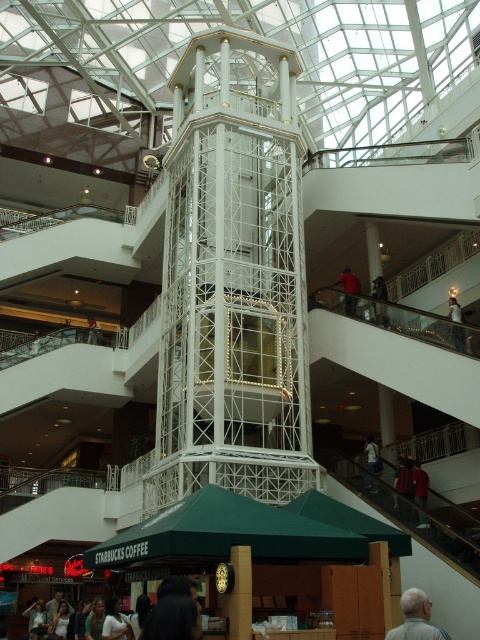
From the picture: Is white metallic pillar at center further to camera compared to dark blue jeans at center?

No, white metallic pillar at center is closer to the viewer.

Based on the photo, who is higher up, white metallic pillar at center or dark blue jeans at center?

dark blue jeans at center

At what (x,y) coordinates should I click in order to perform the action: click on white metallic pillar at center. Please return your answer as a coordinate pair (x, y). Looking at the image, I should click on (240, 593).

Between point (421, 508) and point (383, 321), which one is positioned in front?

Point (421, 508) is more forward.

Is red shirt at lower right thinner than dark blue jeans at center?

In fact, red shirt at lower right might be wider than dark blue jeans at center.

At what (x,y) coordinates should I click in order to perform the action: click on red shirt at lower right. Please return your answer as a coordinate pair (x, y). The width and height of the screenshot is (480, 640). Looking at the image, I should click on (420, 492).

Can you confirm if green fabric canopy at lower center is positioned to the left of white metallic pillar at center?

Indeed, green fabric canopy at lower center is positioned on the left side of white metallic pillar at center.

Measure the distance between point [204,563] and camera.

Point [204,563] is 32.81 meters from camera.

What do you see at coordinates (226, 534) in the screenshot? This screenshot has height=640, width=480. I see `green fabric canopy at lower center` at bounding box center [226, 534].

Find the location of `green fabric canopy at lower center`. green fabric canopy at lower center is located at coordinates (226, 534).